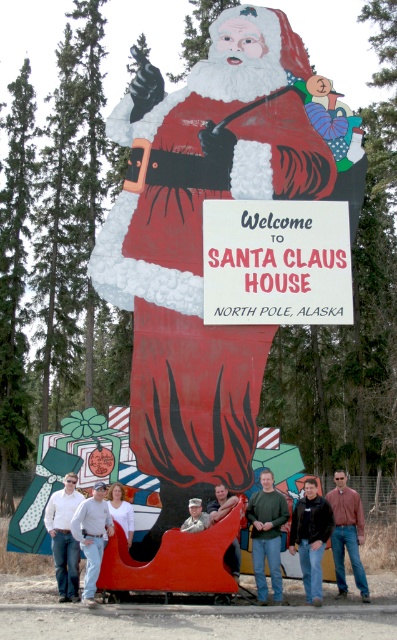
Question: Which point is farther to the camera?

Choices:
 (A) (67, 557)
 (B) (327, 531)
 (C) (260, 586)

Answer: (A)

Question: Does dark blue jeans at lower center come in front of brown leather jacket at lower right?

Choices:
 (A) no
 (B) yes

Answer: (B)

Question: Which object is farther from the camera taking this photo?

Choices:
 (A) matte red santa claus at center
 (B) white shirt at center

Answer: (A)

Question: Is matte red santa claus at center smaller than white paper sign at center?

Choices:
 (A) no
 (B) yes

Answer: (A)

Question: Which of the following is the farthest from the observer?

Choices:
 (A) white paper sign at center
 (B) white cotton shirt at center

Answer: (A)

Question: Is matte red santa claus at center smaller than green matte shirt at center?

Choices:
 (A) yes
 (B) no

Answer: (B)